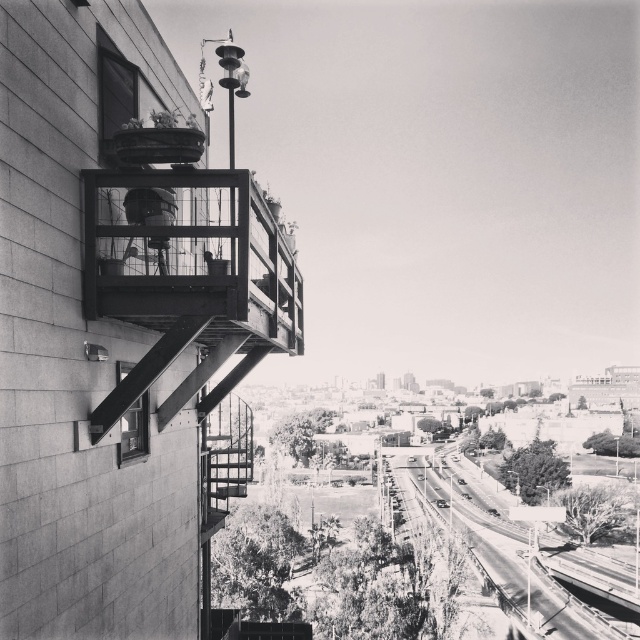
You are a delivery drone flying at the height of the wooden balcony at center. You need to land on the smooth asphalt road at lower center. Can you safely descend vertically from the balcony to the road without any obstacles?

The wooden balcony at center is much taller than the smooth asphalt road at lower center, so yes, you can safely descend vertically from the wooden balcony at center to the smooth asphalt road at lower center as there are no mentioned obstacles in the scene description.

You are an architect assessing the structural integrity of the wooden balcony at center and the clear glass window at lower left. Which one has a greater width according to the measurements?

The wooden balcony at center has a greater width than the clear glass window at lower left.

You are standing on the ground level looking up at the building. There is a point marked at coordinates (188, 253). What does this point indicate?

The point at coordinates (188, 253) indicates the wooden balcony at center.